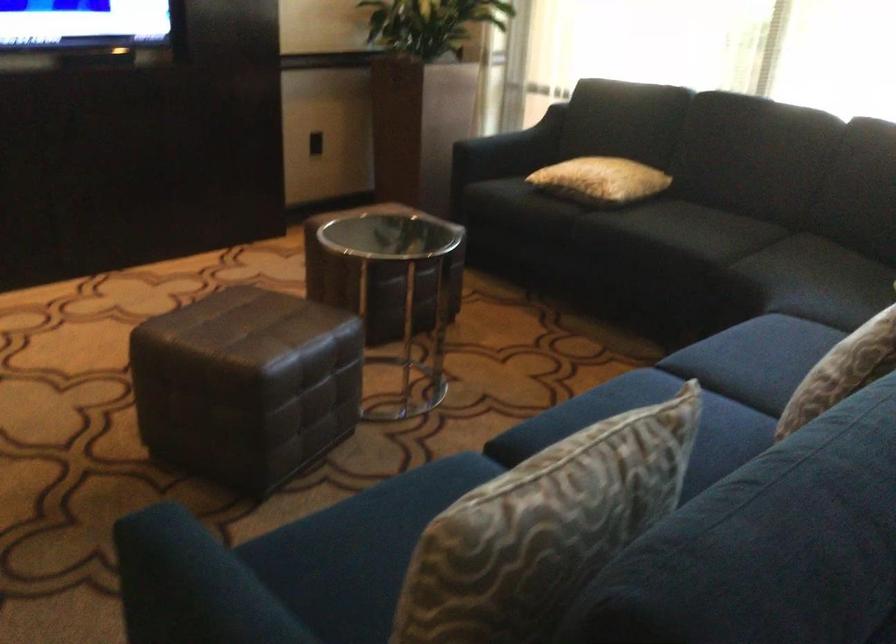
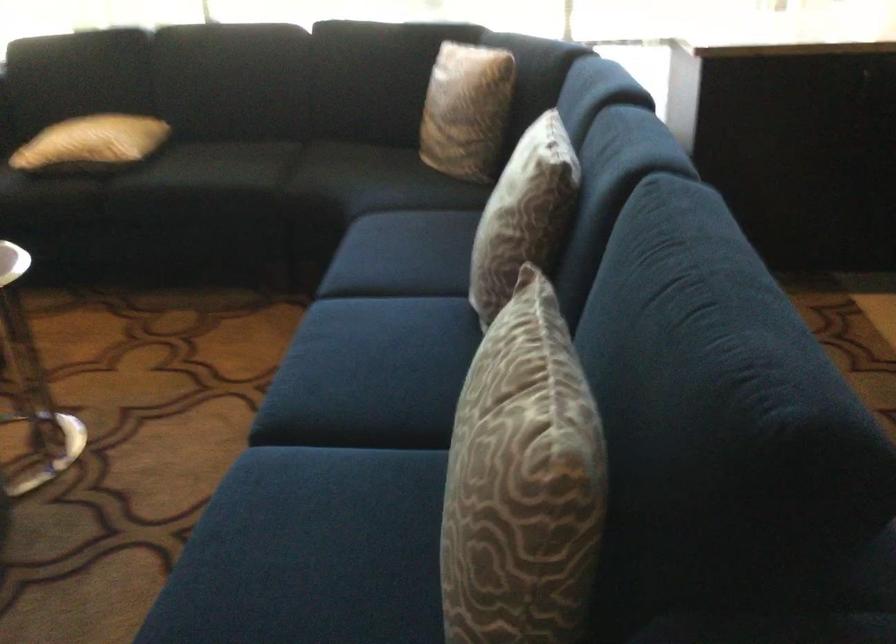
The point at (x=590, y=176) is marked in the first image. Where is the corresponding point in the second image?

(91, 142)